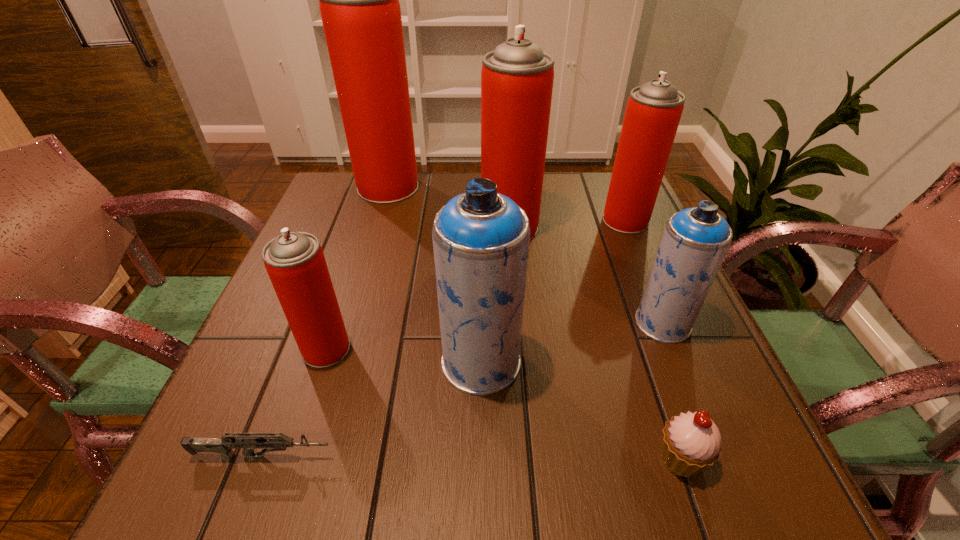
This screenshot has width=960, height=540. I want to click on the farthest red aerosol can, so click(x=359, y=4).

What are the coordinates of `the farthest aerosol can` in the screenshot? It's located at (359, 4).

Where is `the second biggest red aerosol can`? the second biggest red aerosol can is located at coordinates (517, 77).

Where is `the fifth shortest aerosol can`? Image resolution: width=960 pixels, height=540 pixels. the fifth shortest aerosol can is located at coordinates (517, 77).

The width and height of the screenshot is (960, 540). I want to click on the rightmost red aerosol can, so click(x=653, y=112).

Where is `the left blue aerosol can`? the left blue aerosol can is located at coordinates (481, 238).

Where is `the nearest red aerosol can`? the nearest red aerosol can is located at coordinates (295, 262).

Identify the location of the right blue aerosol can. This screenshot has height=540, width=960. [x=695, y=241].

The width and height of the screenshot is (960, 540). Identify the location of the seventh tallest object. (691, 442).

Identify the location of the shortest object. This screenshot has height=540, width=960. (223, 445).